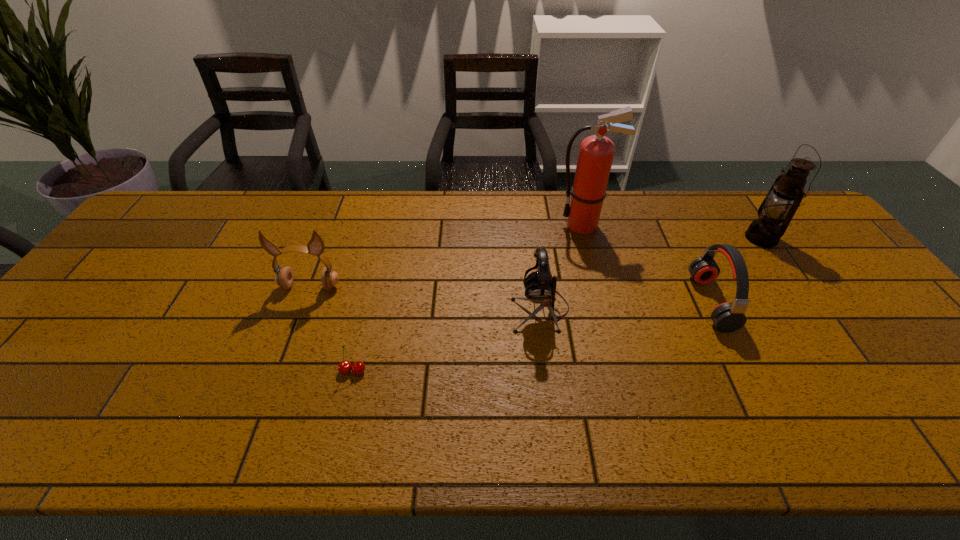
The image size is (960, 540). Identify the location of vacant area situated on the hose direction of the third object from right to left. (512, 225).

Identify the location of vacant space situated 0.320m on the hose direction of the third object from right to left. The image size is (960, 540). (456, 225).

Where is `vacant space located on the hose direction of the third object from right to left`? This screenshot has width=960, height=540. vacant space located on the hose direction of the third object from right to left is located at coordinates (512, 225).

Identify the location of vacant space located 0.060m on the right of the rightmost object. The image size is (960, 540). (796, 238).

You are a GUI agent. You are given a task and a screenshot of the screen. Output one action in this format:
    pyautogui.click(x=<x>, y=<y>)
    Task: Click on the free location located 0.120m on the back of the second earphone from right to left
    Image resolution: width=960 pixels, height=540 pixels.
    Given the screenshot: What is the action you would take?
    534,259

Identify the location of free spot located on the front-facing side of the leftmost earphone. (276, 376).

Where is `free spot located 0.260m on the ear cups of the shortest earphone`? Image resolution: width=960 pixels, height=540 pixels. free spot located 0.260m on the ear cups of the shortest earphone is located at coordinates (600, 302).

The width and height of the screenshot is (960, 540). I want to click on free space located 0.380m on the ear cups of the shortest earphone, so click(555, 302).

Where is `free space located 0.210m on the ear cups of the shortest earphone`? Image resolution: width=960 pixels, height=540 pixels. free space located 0.210m on the ear cups of the shortest earphone is located at coordinates (619, 302).

The image size is (960, 540). I want to click on free location located 0.090m with the stems of the fifth object from right to left pointing upwards, so click(343, 414).